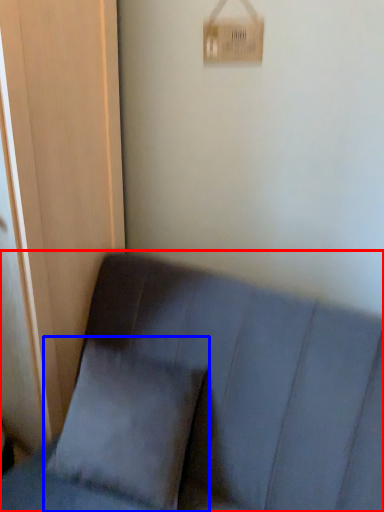
Question: Which point is closer to the camera, furniture (highlighted by a red box) or pillow (highlighted by a blue box)?

Choices:
 (A) furniture
 (B) pillow

Answer: (A)